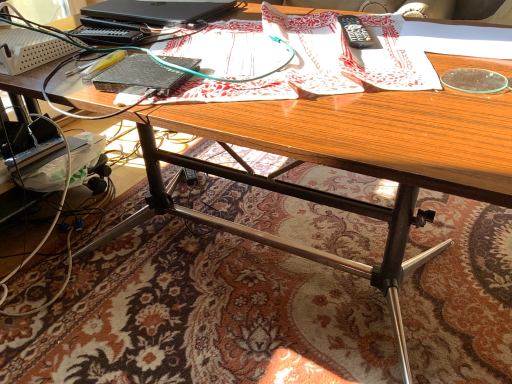
This screenshot has width=512, height=384. Find the location of `unoccupied region to the right of black plastic remote control at upper right`. unoccupied region to the right of black plastic remote control at upper right is located at coordinates (401, 34).